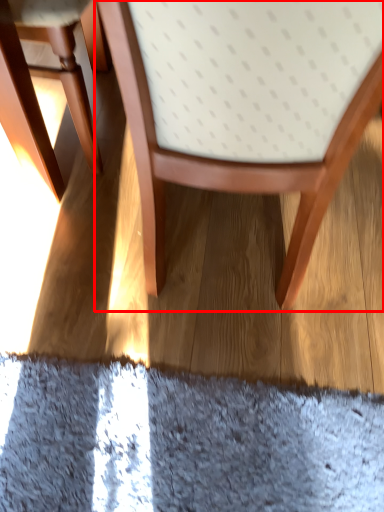
Question: From the image's perspective, considering the relative positions of chair (annotated by the red box) and chair in the image provided, where is chair (annotated by the red box) located with respect to the staircase?

Choices:
 (A) above
 (B) below

Answer: (B)